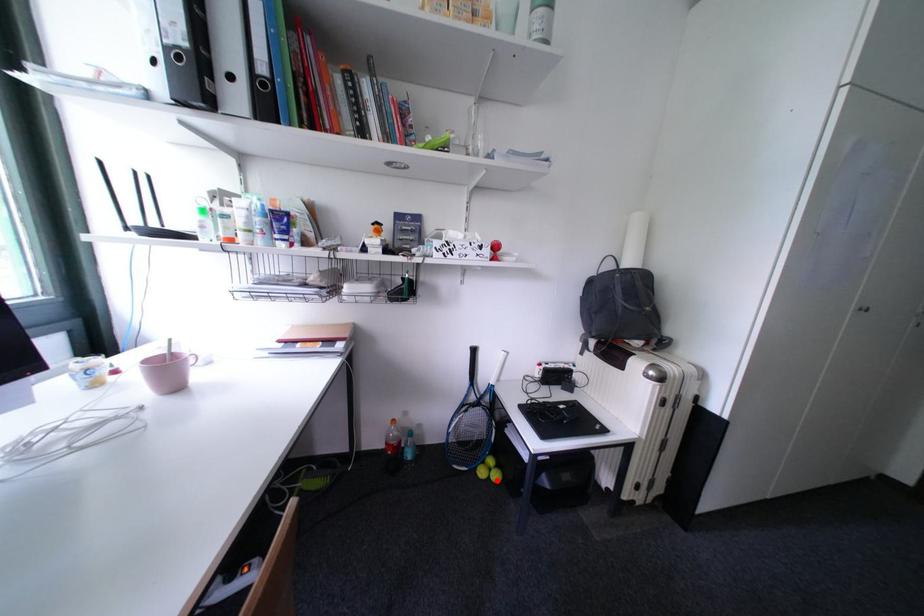
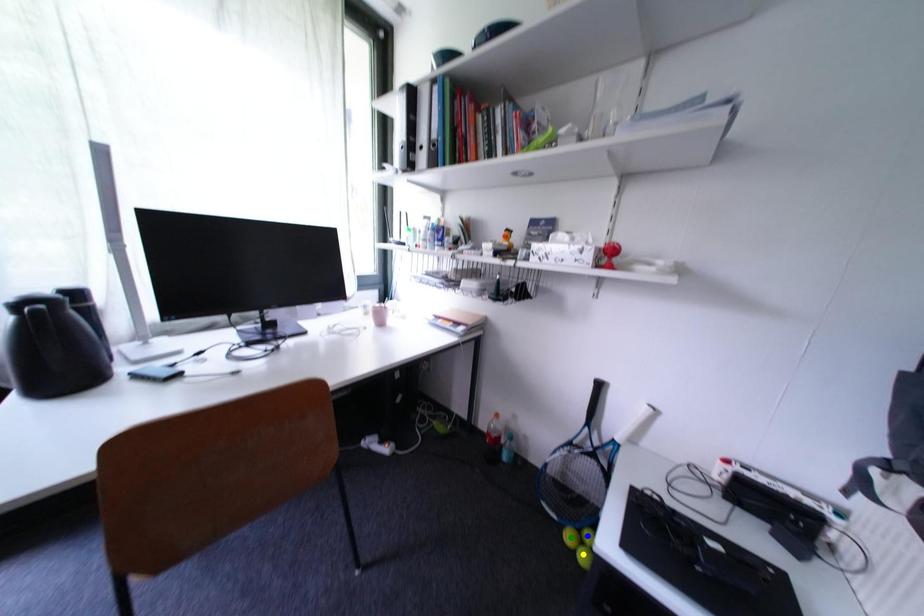
Question: I am providing you with two images of the same scene from different viewpoints. A red point is marked on the first image. You are given multiple points on the second image. Which mark in image 2 goes with the point in image 1?

Choices:
 (A) yellow point
 (B) blue point
 (C) green point

Answer: (A)